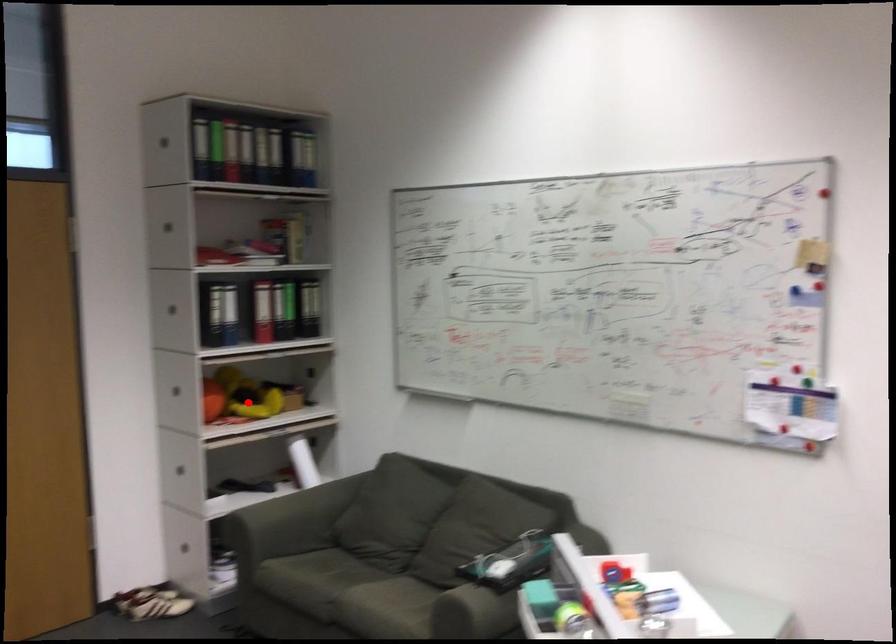
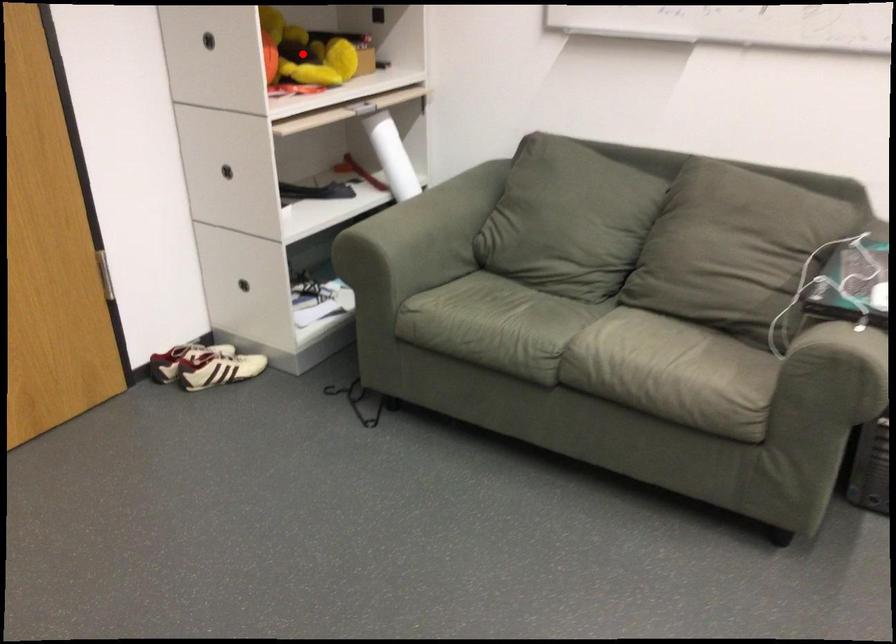
I am providing you with two images of the same scene from different viewpoints. A red point is marked on the first image and another point is marked on the second image. Is the marked point in image1 the same physical position as the marked point in image2?

Yes